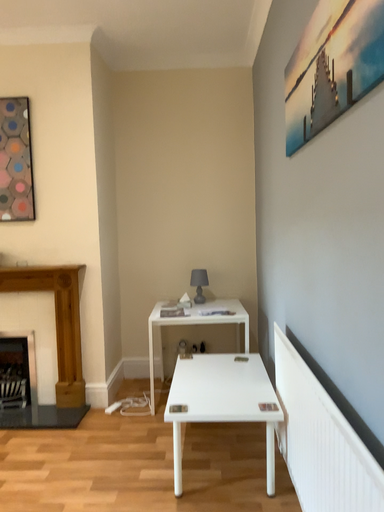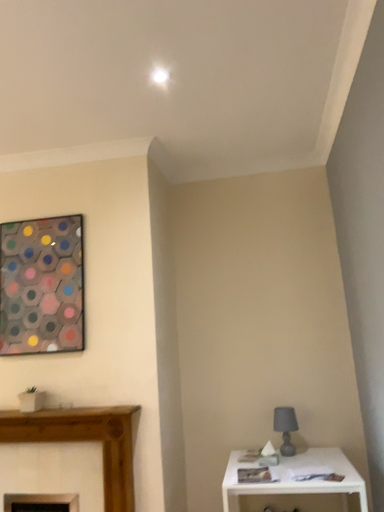
Question: Which way did the camera rotate in the video?

Choices:
 (A) rotated downward
 (B) rotated upward

Answer: (B)